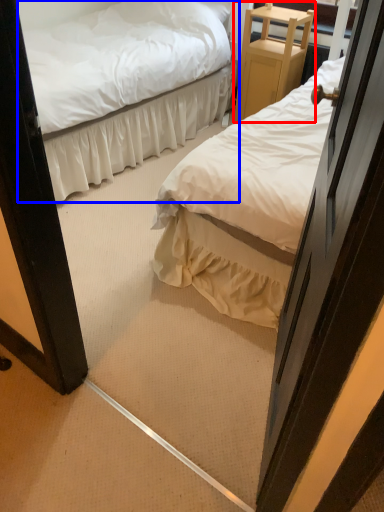
Question: Which of the following is the farthest to the observer, furniture (highlighted by a red box) or bed (highlighted by a blue box)?

Choices:
 (A) furniture
 (B) bed

Answer: (A)